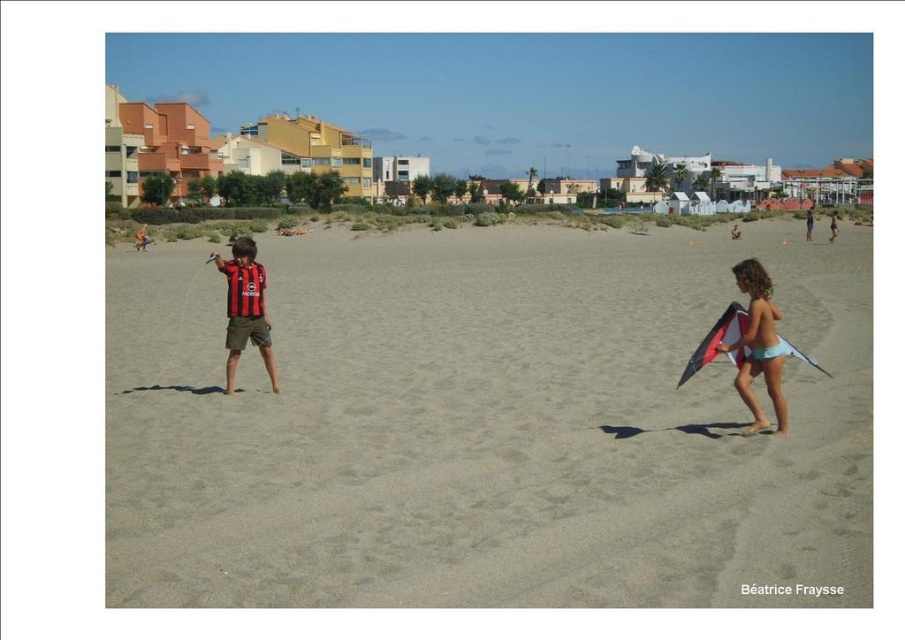
Is smooth sand at center bigger than black jersey at center?

Correct, smooth sand at center is larger in size than black jersey at center.

Find the location of `smooth sand at center`. smooth sand at center is located at coordinates tap(484, 428).

Does point (742, 285) come closer to viewer compared to point (802, 356)?

That is False.

Which is below, teal fabric bikini at right or multicolored fabric kite at right?

multicolored fabric kite at right is lower down.

Does point (783, 352) lie behind point (698, 349)?

No, it is in front of (698, 349).

The width and height of the screenshot is (905, 640). What are the coordinates of `teal fabric bikini at right` in the screenshot? It's located at (759, 346).

Does point (405, 458) lie in front of point (778, 433)?

Yes.

Does point (667, 442) lie in front of point (757, 275)?

Yes.

Image resolution: width=905 pixels, height=640 pixels. Identify the location of smooth sand at center. (484, 428).